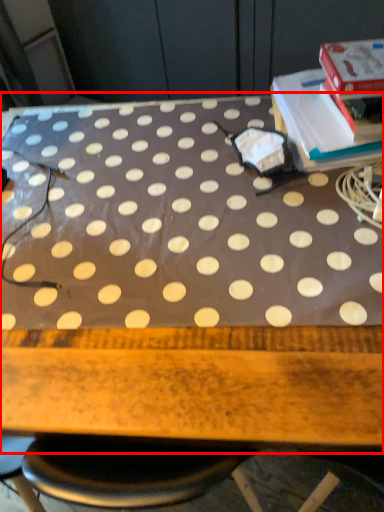
Question: From the image's perspective, what is the correct spatial positioning of table (annotated by the red box) in reference to paperback book?

Choices:
 (A) below
 (B) above

Answer: (A)